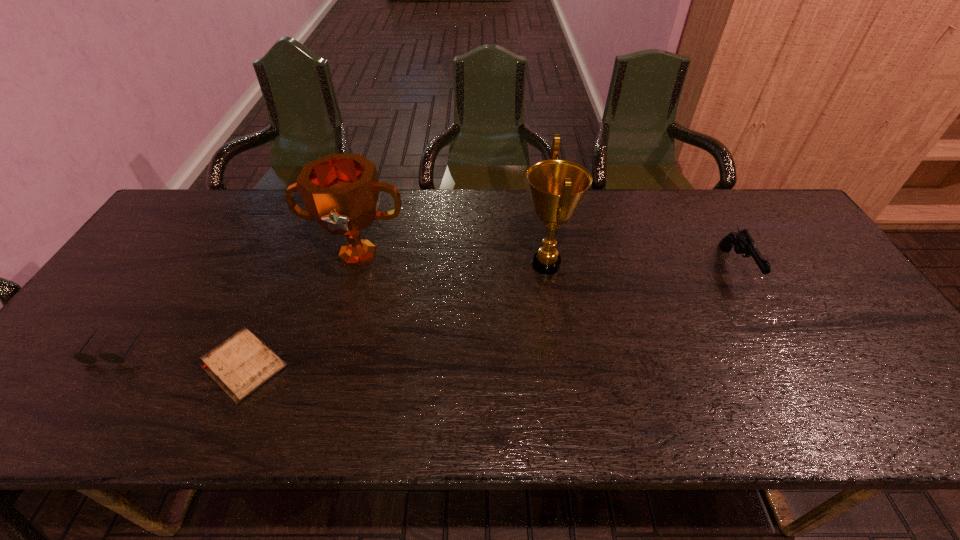
Find the location of a particular element. This screenshot has height=540, width=960. vacant point located 0.070m on the front view with handles of the tallest object is located at coordinates (494, 264).

Locate an element on the screen. The image size is (960, 540). blank space located 0.220m on the front view with handles of the tallest object is located at coordinates (442, 264).

This screenshot has width=960, height=540. Find the location of `free spot located on the side of the second tallest object with the star emblem`. free spot located on the side of the second tallest object with the star emblem is located at coordinates (319, 393).

Image resolution: width=960 pixels, height=540 pixels. I want to click on vacant space located 0.100m at the end of the barrel of the third tallest object, so click(769, 326).

At what (x,y) coordinates should I click in order to perform the action: click on vacant position located on the front-facing side of the second shortest object. Please return your answer as a coordinate pair (x, y). The width and height of the screenshot is (960, 540). Looking at the image, I should click on (85, 392).

Where is `free location located 0.300m on the back of the diary`? free location located 0.300m on the back of the diary is located at coordinates (295, 249).

The image size is (960, 540). What are the coordinates of `object located in the far edge section of the desktop` in the screenshot? It's located at (341, 192).

Where is `object that is at the near edge`? object that is at the near edge is located at coordinates (240, 365).

Where is `object located at the left edge`? The image size is (960, 540). object located at the left edge is located at coordinates (81, 357).

In order to click on vacant space at the far edge of the desktop in this screenshot , I will do `click(221, 224)`.